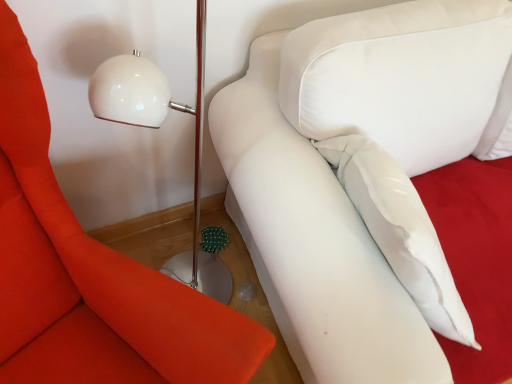
Measure the distance between white fabric pillow at upper right and camera.

The depth of white fabric pillow at upper right is 23.13 inches.

Describe the element at coordinates (90, 275) in the screenshot. The image size is (512, 384). I see `white fabric pillow at upper right` at that location.

Find the location of a particular element. The height and width of the screenshot is (384, 512). white fabric pillow at upper right is located at coordinates (90, 275).

In order to face white fabric pillow at upper right, should I rotate leftwards or rightwards?

Turn left approximately 18.241 degrees to face it.

Measure the distance between point (x=251, y=154) and camera.

They are 39.17 inches apart.

Identify the location of white soft couch at upper right. The height and width of the screenshot is (384, 512). (358, 177).

The width and height of the screenshot is (512, 384). Describe the element at coordinates (358, 177) in the screenshot. I see `white soft couch at upper right` at that location.

Where is `white fabric pillow at upper right`? white fabric pillow at upper right is located at coordinates (90, 275).

Is white fabric pillow at upper right to the right of white soft couch at upper right from the viewer's perspective?

No.

Which object is more forward, white fabric pillow at upper right or white soft couch at upper right?

white fabric pillow at upper right is closer to the camera.

Is point (239, 340) farther from viewer compared to point (426, 73)?

No, it is not.

From the image's perspective, would you say white fabric pillow at upper right is shown under white soft couch at upper right?

Yes, from the image's perspective, white fabric pillow at upper right is beneath white soft couch at upper right.

From a real-world perspective, which object stands above the other?

In real-world perspective, white fabric pillow at upper right is above.

Can you confirm if white fabric pillow at upper right is thinner than white soft couch at upper right?

Correct, the width of white fabric pillow at upper right is less than that of white soft couch at upper right.

Considering the sizes of objects white fabric pillow at upper right and white soft couch at upper right in the image provided, who is taller, white fabric pillow at upper right or white soft couch at upper right?

white fabric pillow at upper right.

Considering the relative sizes of white fabric pillow at upper right and white soft couch at upper right in the image provided, is white fabric pillow at upper right smaller than white soft couch at upper right?

Indeed, white fabric pillow at upper right has a smaller size compared to white soft couch at upper right.

Would you say white fabric pillow at upper right is inside or outside white soft couch at upper right?

white fabric pillow at upper right cannot be found inside white soft couch at upper right.

Are white fabric pillow at upper right and white soft couch at upper right far apart?

white fabric pillow at upper right is near white soft couch at upper right, not far away.

Is white fabric pillow at upper right facing away from white soft couch at upper right?

No.

Can you tell me how much white fabric pillow at upper right and white soft couch at upper right differ in facing direction?

27.6 degrees.

Where is `studio couch above the white fabric pillow at upper right (from the image's perspective)`? The height and width of the screenshot is (384, 512). studio couch above the white fabric pillow at upper right (from the image's perspective) is located at coordinates (358, 177).

Considering the positions of objects white soft couch at upper right and white fabric pillow at upper right in the image provided, who is more to the right, white soft couch at upper right or white fabric pillow at upper right?

white soft couch at upper right.

Consider the image. Which object is closer to the camera taking this photo, white soft couch at upper right or white fabric pillow at upper right?

white fabric pillow at upper right is closer to the camera.

Is point (220, 94) positioned after point (27, 252)?

Yes.

From the image's perspective, is white soft couch at upper right below white fabric pillow at upper right?

Actually, white soft couch at upper right appears above white fabric pillow at upper right in the image.

Looking at this image, from a real-world perspective, which object rests below the other?

In real-world perspective, white soft couch at upper right is lower.

Considering the relative sizes of white soft couch at upper right and white fabric pillow at upper right in the image provided, is white soft couch at upper right thinner than white fabric pillow at upper right?

No, white soft couch at upper right is not thinner than white fabric pillow at upper right.

From their relative heights in the image, would you say white soft couch at upper right is taller or shorter than white fabric pillow at upper right?

white soft couch at upper right is shorter than white fabric pillow at upper right.

Considering the sizes of objects white soft couch at upper right and white fabric pillow at upper right in the image provided, who is bigger, white soft couch at upper right or white fabric pillow at upper right?

white soft couch at upper right.

Would you say white soft couch at upper right is inside or outside white fabric pillow at upper right?

white soft couch at upper right lies outside white fabric pillow at upper right.

Is white soft couch at upper right not close to white fabric pillow at upper right?

No, white soft couch at upper right is not far away from white fabric pillow at upper right.

Is white soft couch at upper right looking in the opposite direction of white fabric pillow at upper right?

No, white fabric pillow at upper right is not at the back of white soft couch at upper right.

Consider the image. How far apart are white soft couch at upper right and white fabric pillow at upper right?

white soft couch at upper right is 17.65 inches away from white fabric pillow at upper right.

At what (x,y) coordinates should I click in order to perform the action: click on studio couch above the white fabric pillow at upper right (from the image's perspective). Please return your answer as a coordinate pair (x, y). Looking at the image, I should click on coord(358,177).

You are a GUI agent. You are given a task and a screenshot of the screen. Output one action in this format:
    pyautogui.click(x=<x>, y=<y>)
    Task: Click on the furniture in front of the white soft couch at upper right
    
    Given the screenshot: What is the action you would take?
    pyautogui.click(x=90, y=275)

I want to click on studio couch that is above the white fabric pillow at upper right (from the image's perspective), so click(x=358, y=177).